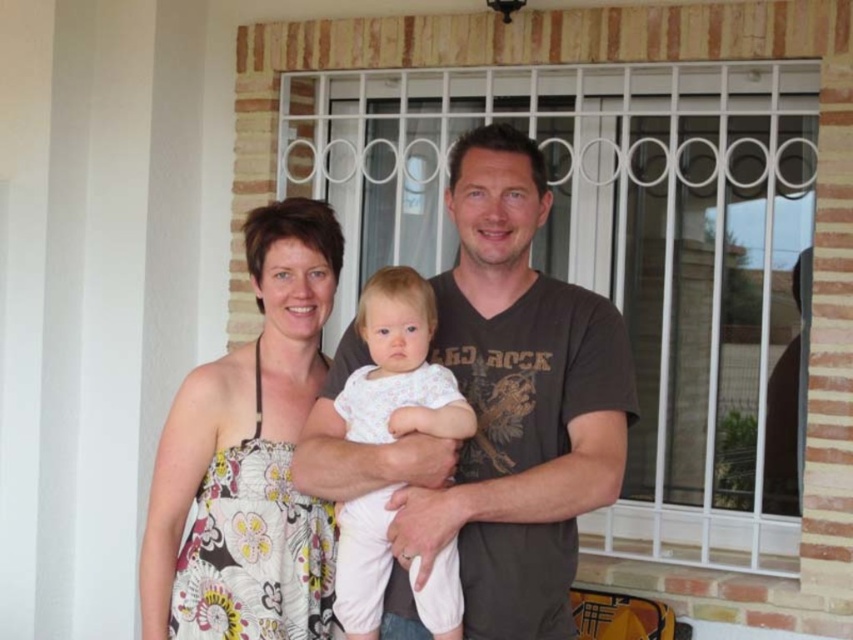
You are a delivery person trying to hand a package to the family through the white metal screen door at center while avoiding the white cotton baby at center. Is the door large enough for you to pass the package without touching the baby?

The white metal screen door at center is bigger than the white cotton baby at center, so yes, the delivery person can pass the package through the door without touching the baby since the door is larger in size.

You are standing at the origin point in the image and want to walk towards the two points marked in the scene. Which point would you encounter first, point (312, 83) or point (463, 486)?

You would encounter point (463, 486) first because it is closer to you than point (312, 83), which is further away.

You are a delivery person trying to hand a package to the family through the white metal screen door at center. The baby is standing next to the door. Can you see the white cotton baby at center through the door?

The white metal screen door at center is taller than the white cotton baby at center, so yes, you can see the baby through the door since the door is higher up and the baby is shorter.